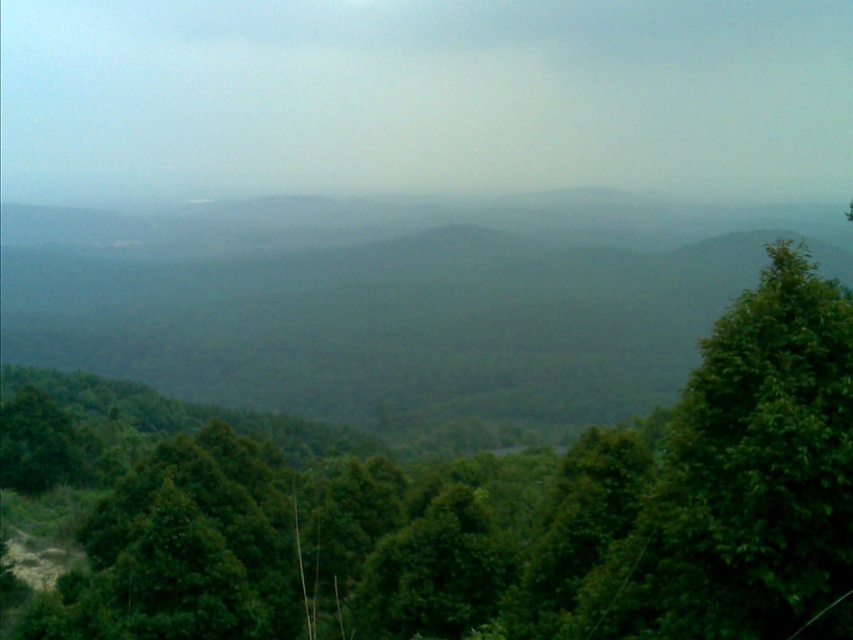
Question: Which point is closer to the camera taking this photo?

Choices:
 (A) (694, 282)
 (B) (811, 561)

Answer: (B)

Question: Where is green leafy tree at center located in relation to green leafy forest at center in the image?

Choices:
 (A) above
 (B) below

Answer: (B)

Question: Which of the following is the closest to the observer?

Choices:
 (A) coord(300,397)
 (B) coord(724,500)

Answer: (B)

Question: Considering the relative positions of green leafy tree at center and green leafy forest at center in the image provided, where is green leafy tree at center located with respect to green leafy forest at center?

Choices:
 (A) below
 (B) above

Answer: (A)

Question: Does green leafy tree at center appear on the left side of green leafy forest at center?

Choices:
 (A) yes
 (B) no

Answer: (B)